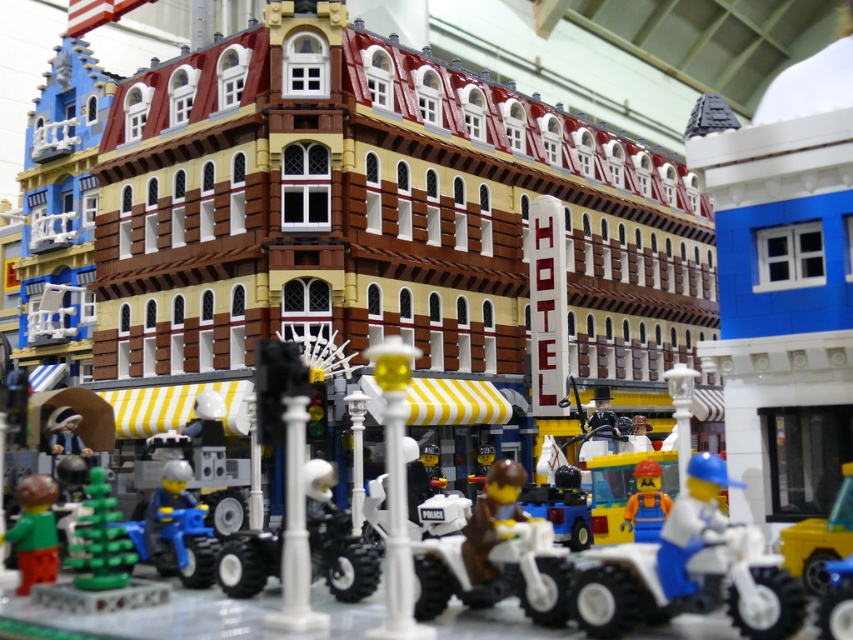
Looking at this image, you are a Lego figure trying to pass through a narrow alley between two buildings in the scene. You see the white matte quad bike at center and the blue plastic figure at center. Which object would you have more difficulty fitting through the alley?

The white matte quad bike at center has a larger width than the blue plastic figure at center, so it would be harder to fit through the narrow alley.

You are a Lego figure standing at point (51, 554) and want to reach the hotel entrance located at point (526, 580). Is the path directly between these two points clear of any obstacles?

Yes, the path between point (526, 580) and point (51, 554) is clear because point (526, 580) is in front of point (51, 554), indicating no obstruction blocks the direct route.